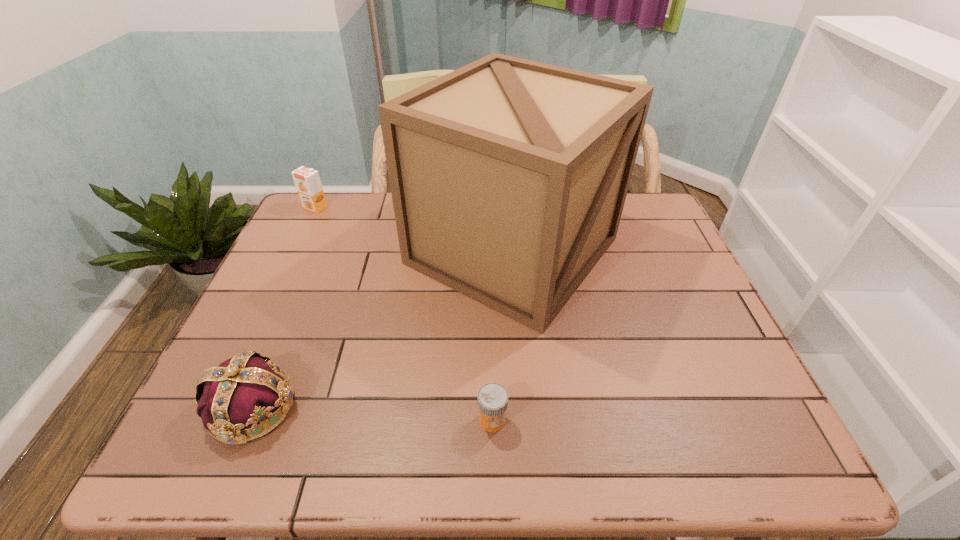
Find the location of a particular element. This screenshot has height=540, width=960. crown that is at the near edge is located at coordinates [246, 389].

At what (x,y) coordinates should I click in order to perform the action: click on medicine that is positioned at the near edge. Please return your answer as a coordinate pair (x, y). The height and width of the screenshot is (540, 960). Looking at the image, I should click on (492, 399).

I want to click on orange juice present at the left edge, so [x=307, y=181].

In order to click on crown that is positioned at the left edge in this screenshot , I will do `click(246, 389)`.

Where is `object that is at the far left corner`? object that is at the far left corner is located at coordinates (307, 181).

Locate an element on the screen. The width and height of the screenshot is (960, 540). object present at the near left corner is located at coordinates (246, 389).

In the image, there is a desktop. What are the coordinates of `vacant space at the far edge` in the screenshot? It's located at (362, 193).

Locate an element on the screen. This screenshot has height=540, width=960. vacant region at the near edge is located at coordinates (516, 462).

In the image, there is a desktop. Identify the location of free space at the left edge. This screenshot has width=960, height=540. (293, 291).

At what (x,y) coordinates should I click in order to perform the action: click on free space at the far left corner. Please return your answer as a coordinate pair (x, y). The width and height of the screenshot is (960, 540). Looking at the image, I should click on (329, 218).